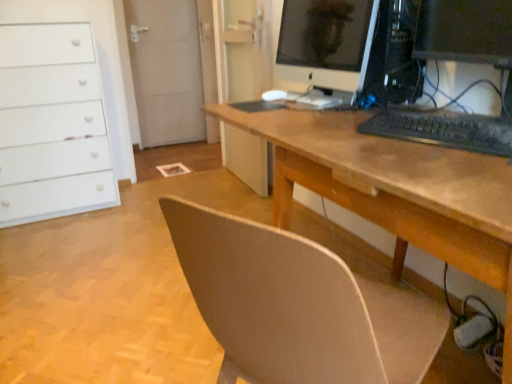
Question: Looking at their shapes, would you say black matte keyboard at center is wider or thinner than wooden desk at center?

Choices:
 (A) thin
 (B) wide

Answer: (A)

Question: From their relative heights in the image, would you say black matte keyboard at center is taller or shorter than wooden desk at center?

Choices:
 (A) tall
 (B) short

Answer: (B)

Question: Which object is positioned closest to the black matte keyboard at center?

Choices:
 (A) matte black monitor at upper right
 (B) wooden desk at center
 (C) white matte chest of drawers at left
 (D) satin black monitor at center
 (E) black plastic keyboard at right

Answer: (E)

Question: Estimate the real-world distances between objects in this image. Which object is closer to the black matte keyboard at center?

Choices:
 (A) satin black monitor at center
 (B) white matte chest of drawers at left
 (C) matte black monitor at upper right
 (D) wooden desk at center
 (E) black plastic keyboard at right

Answer: (E)